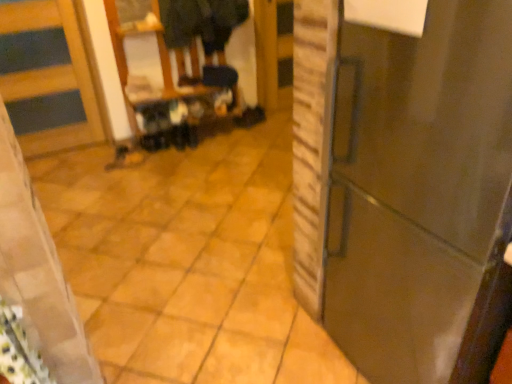
Question: From the image's perspective, is matte black shoe at center beneath dark fabric coat at upper center?

Choices:
 (A) no
 (B) yes

Answer: (B)

Question: Can you confirm if matte black shoe at center is positioned to the left of dark fabric coat at upper center?

Choices:
 (A) yes
 (B) no

Answer: (A)

Question: Does matte black shoe at center lie behind dark fabric coat at upper center?

Choices:
 (A) yes
 (B) no

Answer: (A)

Question: Is matte black shoe at center facing away from dark fabric coat at upper center?

Choices:
 (A) no
 (B) yes

Answer: (A)

Question: Does matte black shoe at center have a smaller size compared to dark fabric coat at upper center?

Choices:
 (A) yes
 (B) no

Answer: (A)

Question: Could you tell me if matte black shoe at center is facing dark fabric coat at upper center?

Choices:
 (A) yes
 (B) no

Answer: (B)

Question: Is matte black shoe at center surrounded by matte black step stool at center?

Choices:
 (A) yes
 (B) no

Answer: (B)

Question: Is matte black step stool at center thinner than matte black shoe at center?

Choices:
 (A) no
 (B) yes

Answer: (A)

Question: Is matte black step stool at center beside matte black shoe at center?

Choices:
 (A) yes
 (B) no

Answer: (B)

Question: Considering the relative sizes of matte black step stool at center and matte black shoe at center in the image provided, is matte black step stool at center shorter than matte black shoe at center?

Choices:
 (A) no
 (B) yes

Answer: (A)

Question: Is matte black step stool at center wider than matte black shoe at center?

Choices:
 (A) no
 (B) yes

Answer: (B)

Question: Is matte black step stool at center bigger than matte black shoe at center?

Choices:
 (A) no
 (B) yes

Answer: (B)

Question: Considering the relative sizes of glossy dark brown door at right, positioned as the second door in left-to-right order, and matte black shoe at center in the image provided, is glossy dark brown door at right, positioned as the second door in left-to-right order, wider than matte black shoe at center?

Choices:
 (A) no
 (B) yes

Answer: (B)